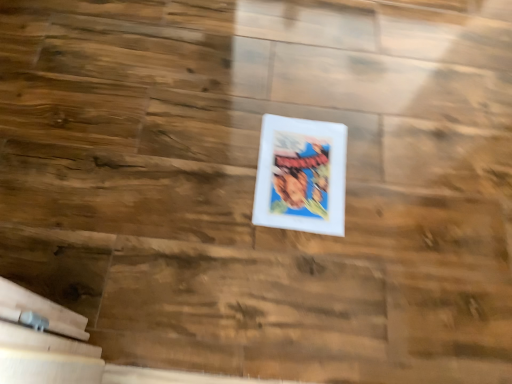
Where is `free space behind white matte picture frame at center`? The image size is (512, 384). free space behind white matte picture frame at center is located at coordinates (317, 91).